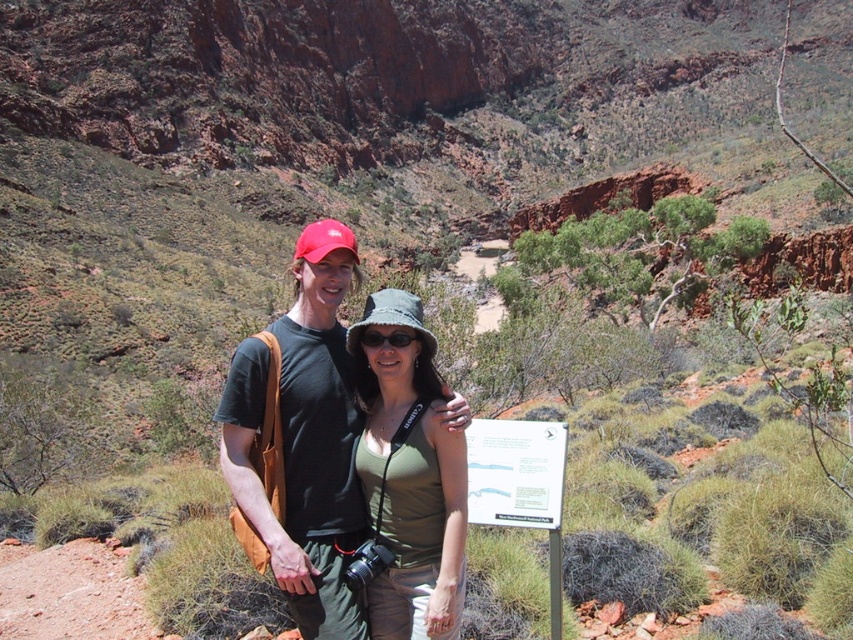
You are a photographer trying to capture a closeup of the matte black shirt at center and the black matte sunglasses at center. Since the camera can only focus on one object at a time, which object should you focus on first to ensure it fits entirely within the frame?

The matte black shirt at center has a greater width than the black matte sunglasses at center, so you should focus on the matte black shirt at center first to ensure it fits entirely within the frame.

You are a photographer trying to capture a landscape photo. You have two points of interest in the scene, point 1 at coordinates point [300,269] and point 2 at coordinates point [426,561]. Which point is closer to the camera lens?

Point [300,269] is further to the viewer than point [426,561], so the point closer to the camera lens is point [426,561].

You are a photographer trying to capture a closeup of the green fabric hat at center and the black matte sunglasses at center. Since both are at the center, which one would you focus on first if you want to ensure both are in focus?

The green fabric hat at center is wider than black matte sunglasses at center, so focusing on the green fabric hat at center first would help ensure both are in focus as it requires a larger depth of field.